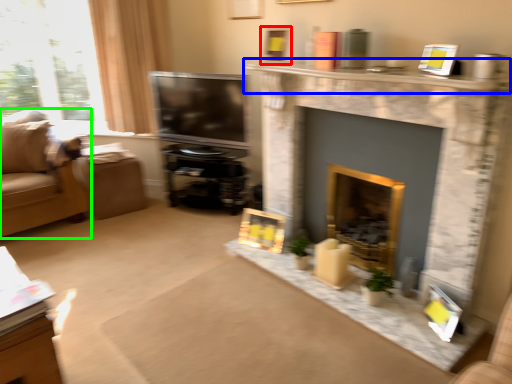
Question: Which object is the farthest from picture frame (highlighted by a red box)? Choose among these: mantle (highlighted by a blue box) or studio couch (highlighted by a green box).

Choices:
 (A) mantle
 (B) studio couch

Answer: (B)